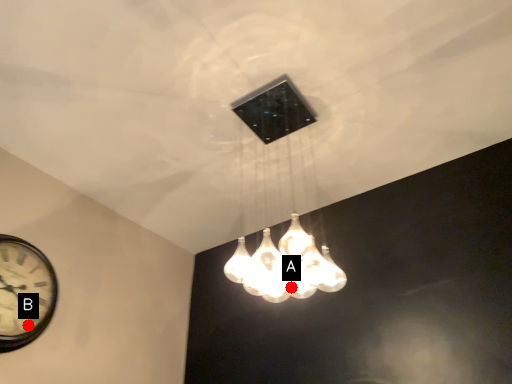
Question: Two points are circled on the image, labeled by A and B beside each circle. Among these points, which one is farthest from the camera?

Choices:
 (A) A is further
 (B) B is further

Answer: (B)